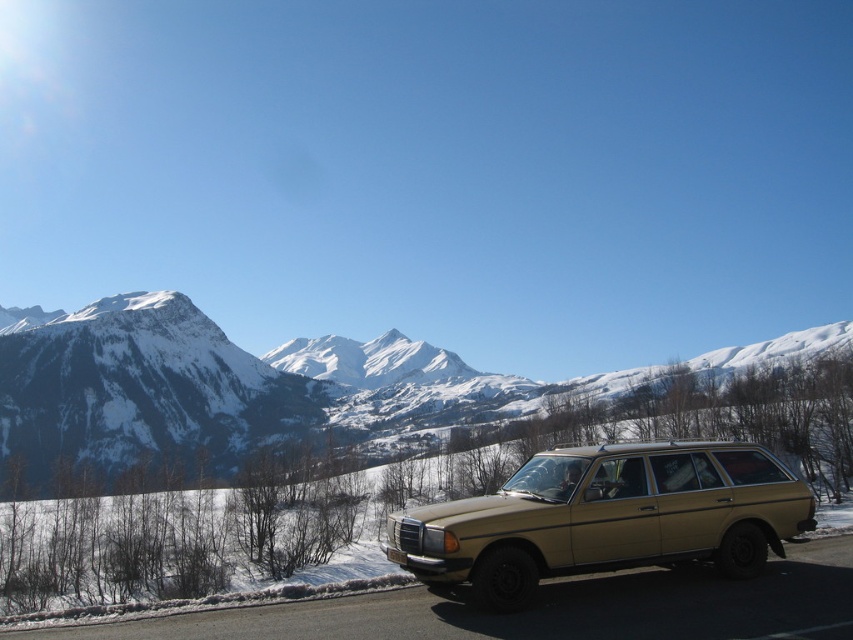
Question: Which object appears closest to the camera in this image?

Choices:
 (A) snowy white mountain range at upper left
 (B) gold metallic station wagon at lower right

Answer: (B)

Question: Considering the relative positions of snowy white mountain range at upper left and gold metallic station wagon at lower right in the image provided, where is snowy white mountain range at upper left located with respect to gold metallic station wagon at lower right?

Choices:
 (A) left
 (B) right

Answer: (A)

Question: Is snowy white mountain range at upper left behind gold metallic station wagon at lower right?

Choices:
 (A) yes
 (B) no

Answer: (A)

Question: Is snowy white mountain range at upper left positioned at the back of gold metallic station wagon at lower right?

Choices:
 (A) yes
 (B) no

Answer: (A)

Question: Among these points, which one is nearest to the camera?

Choices:
 (A) (579, 515)
 (B) (668, 372)

Answer: (A)